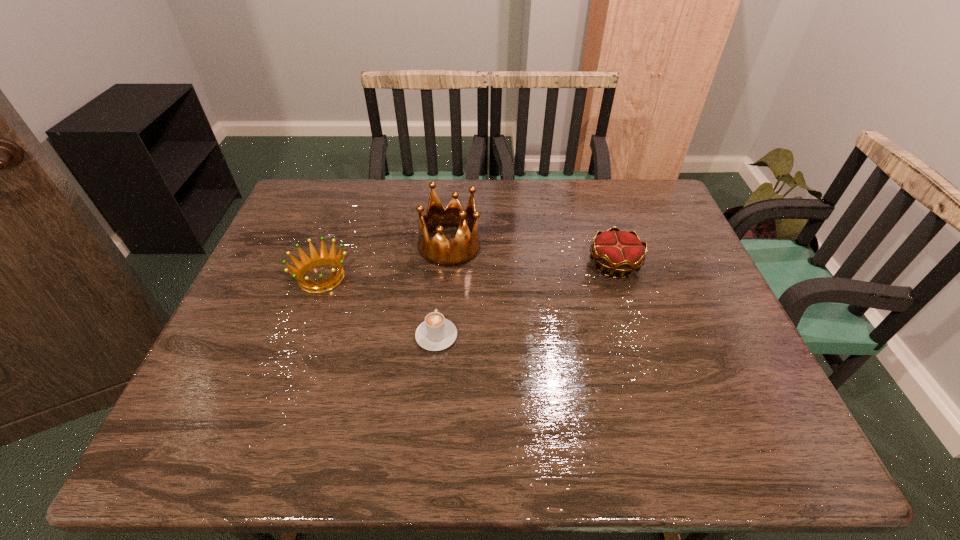
At what (x,y) coordinates should I click in order to perform the action: click on free space between the rightmost crown and the shortest object. Please return your answer as a coordinate pair (x, y). The image size is (960, 540). Looking at the image, I should click on (525, 300).

Identify the location of unoccupied position between the leftmost object and the rightmost crown. (468, 271).

Identify the location of vacant space that's between the leftmost crown and the shortest object. Image resolution: width=960 pixels, height=540 pixels. (379, 307).

At what (x,y) coordinates should I click in order to perform the action: click on free spot between the rightmost object and the leftmost crown. Please return your answer as a coordinate pair (x, y). Looking at the image, I should click on (468, 271).

Where is `free spot between the rightmost object and the tallest crown`? This screenshot has height=540, width=960. free spot between the rightmost object and the tallest crown is located at coordinates (532, 255).

Locate an element on the screen. The width and height of the screenshot is (960, 540). vacant space that is in between the second crown from right to left and the rightmost crown is located at coordinates (532, 255).

The width and height of the screenshot is (960, 540). Find the location of `vacant area between the shortest object and the leftmost object`. vacant area between the shortest object and the leftmost object is located at coordinates (379, 307).

Find the location of `object that is the closest one to the leftmost crown`. object that is the closest one to the leftmost crown is located at coordinates (439, 251).

Select which object appears as the closest to the rightmost object. Please provide its 2D coordinates. Your answer should be formatted as a tuple, i.e. [(x, y)], where the tuple contains the x and y coordinates of a point satisfying the conditions above.

[(439, 251)]

Select which crown is the second closest to the second crown from left to right. Please provide its 2D coordinates. Your answer should be formatted as a tuple, i.e. [(x, y)], where the tuple contains the x and y coordinates of a point satisfying the conditions above.

[(617, 251)]